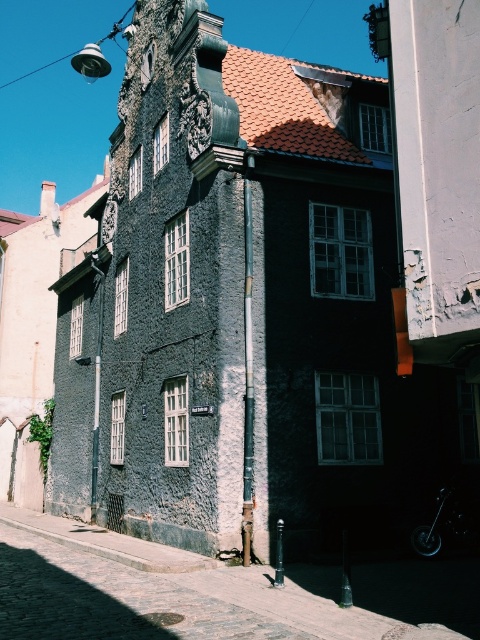
Is cobblestone pavement at lower left wider than shiny metallic motorcycle at lower right?

Indeed, cobblestone pavement at lower left has a greater width compared to shiny metallic motorcycle at lower right.

This screenshot has width=480, height=640. In order to click on cobblestone pavement at lower left in this screenshot , I will do `click(211, 593)`.

Identify the location of cobblestone pavement at lower left. This screenshot has height=640, width=480. (211, 593).